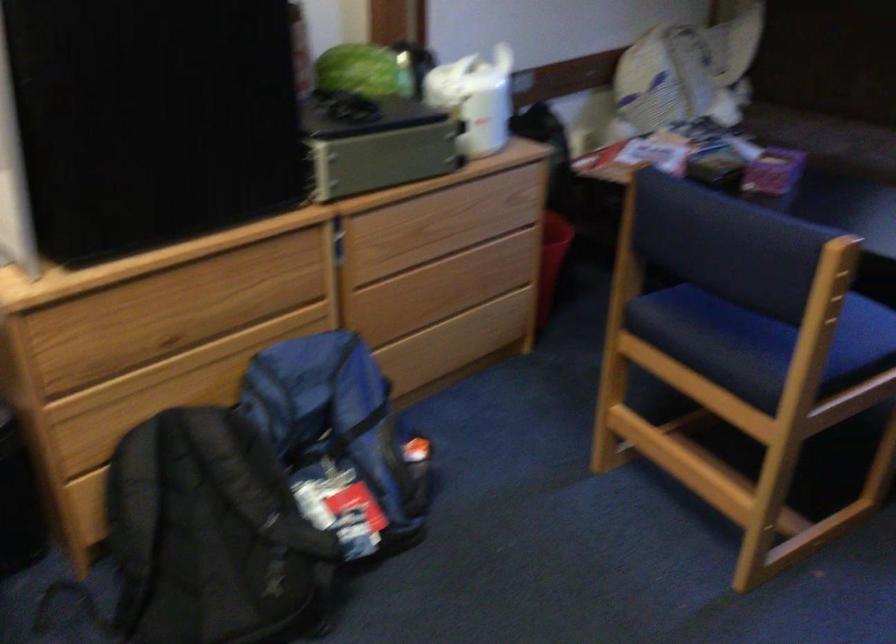
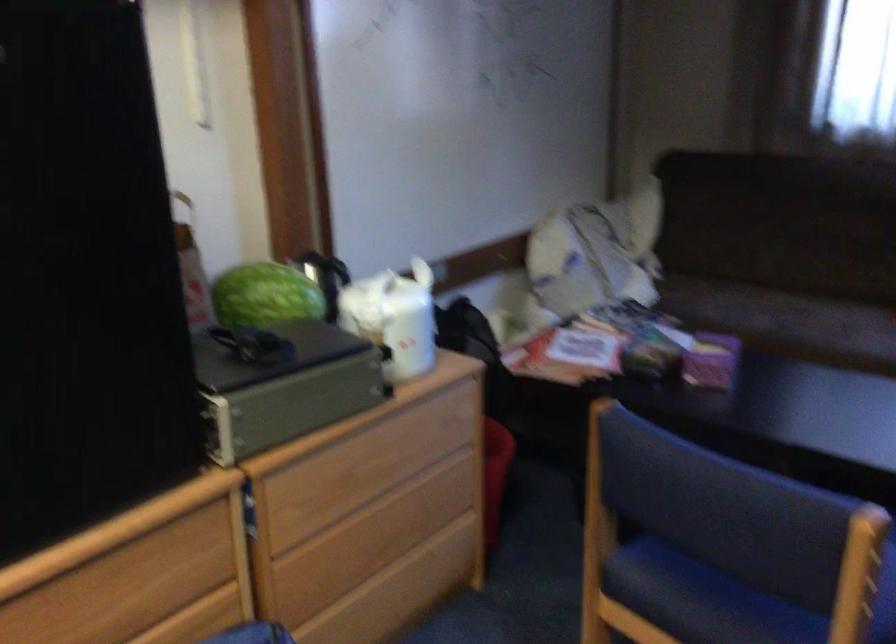
The point at (824, 294) is marked in the first image. Where is the corresponding point in the second image?

(858, 574)